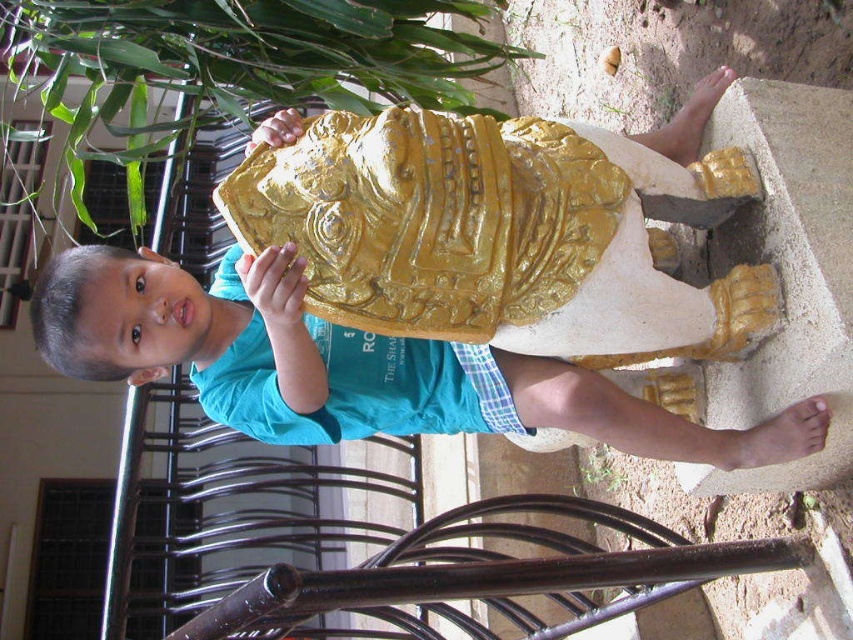
Question: Can you confirm if matte gold statue at center is bigger than green leafy plant at lower center?

Choices:
 (A) yes
 (B) no

Answer: (A)

Question: Which point is farther to the camera?

Choices:
 (A) (587, 472)
 (B) (184, 124)
 (C) (254, 298)

Answer: (A)

Question: Can you confirm if matte gold statue at center is thinner than green leafy plant at upper left?

Choices:
 (A) yes
 (B) no

Answer: (A)

Question: Based on their relative distances, which object is farther from the green leafy plant at upper left?

Choices:
 (A) green leafy plant at lower center
 (B) matte gold statue at center

Answer: (A)

Question: Among these points, which one is farthest from the camera?

Choices:
 (A) (96, 262)
 (B) (613, 458)

Answer: (B)

Question: Can you confirm if matte gold statue at center is bigger than green leafy plant at upper left?

Choices:
 (A) yes
 (B) no

Answer: (B)